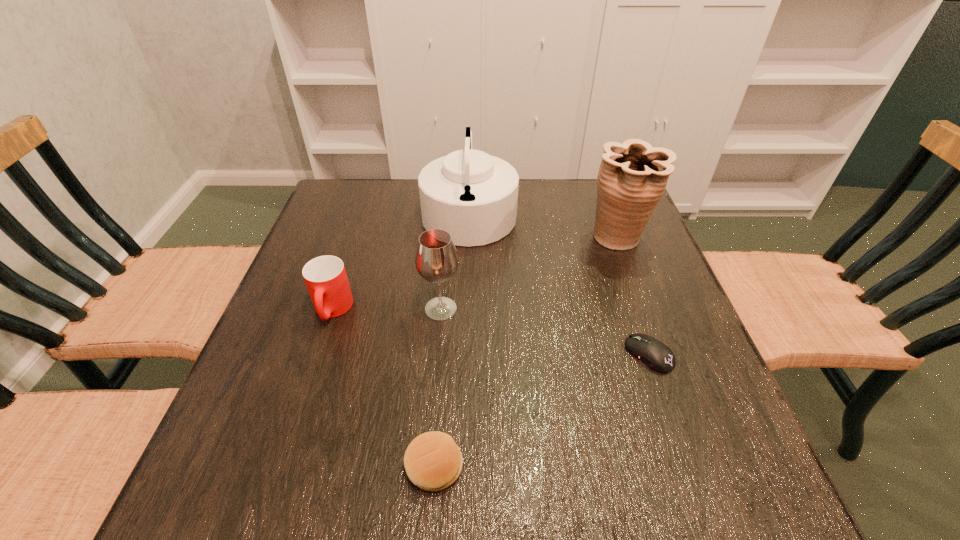
You are a GUI agent. You are given a task and a screenshot of the screen. Output one action in this format:
    pyautogui.click(x=<x>, y=<y>)
    Task: Click on the vacant space that's between the patty and the leftmost object
    Image resolution: width=960 pixels, height=540 pixels.
    Given the screenshot: What is the action you would take?
    pyautogui.click(x=383, y=388)

Identify the location of empty space between the kettle and the second nearest object. This screenshot has width=960, height=540. (559, 282).

The image size is (960, 540). I want to click on free point between the shortest object and the third tallest object, so click(x=545, y=332).

You are a GUI agent. You are given a task and a screenshot of the screen. Output one action in this format:
    pyautogui.click(x=<x>, y=<y>)
    Task: Click on the free space that is in between the fourth tallest object and the computer equipment
    This screenshot has width=960, height=540.
    Given the screenshot: What is the action you would take?
    pyautogui.click(x=491, y=332)

Where is `vacant region between the urn and the wineglass`? The height and width of the screenshot is (540, 960). vacant region between the urn and the wineglass is located at coordinates (530, 273).

The image size is (960, 540). I want to click on vacant space that is in between the fourth tallest object and the wineglass, so pos(387,309).

Identify the location of free space between the second shortest object and the urn. The image size is (960, 540). (526, 352).

Where is `vacant region between the kettle and the patty`? vacant region between the kettle and the patty is located at coordinates (x=452, y=339).

Where is `object that stands as the closest to the urn`? object that stands as the closest to the urn is located at coordinates (472, 195).

Identify which object is the fifth closest to the kettle. Please provide its 2D coordinates. Your answer should be formatted as a tuple, i.e. [(x, y)], where the tuple contains the x and y coordinates of a point satisfying the conditions above.

[(433, 462)]